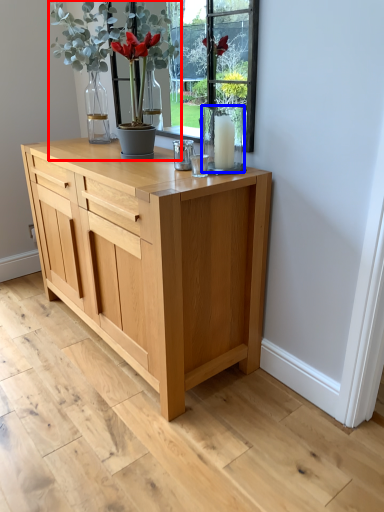
Question: Which point is further to the camera, houseplant (highlighted by a red box) or glass vase (highlighted by a blue box)?

Choices:
 (A) houseplant
 (B) glass vase

Answer: (A)